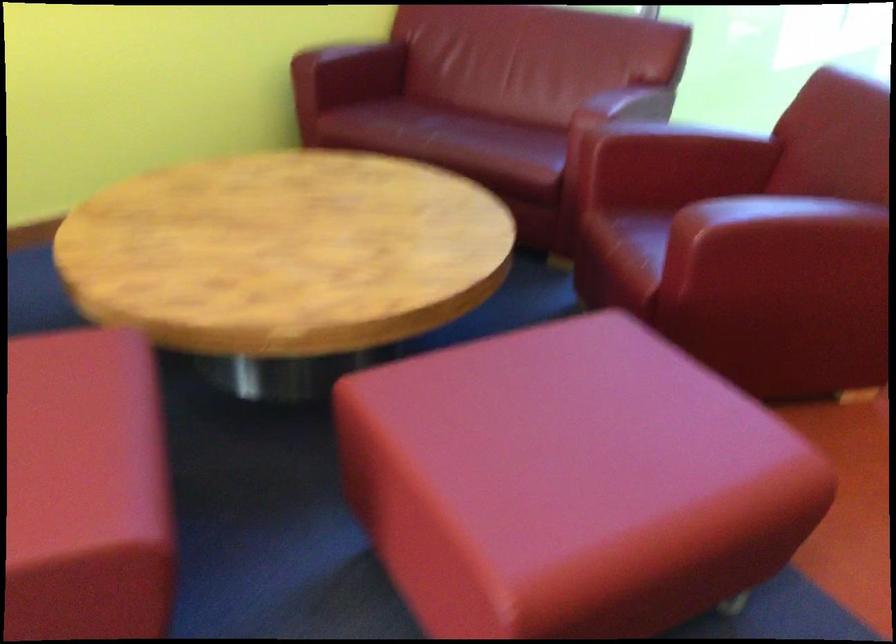
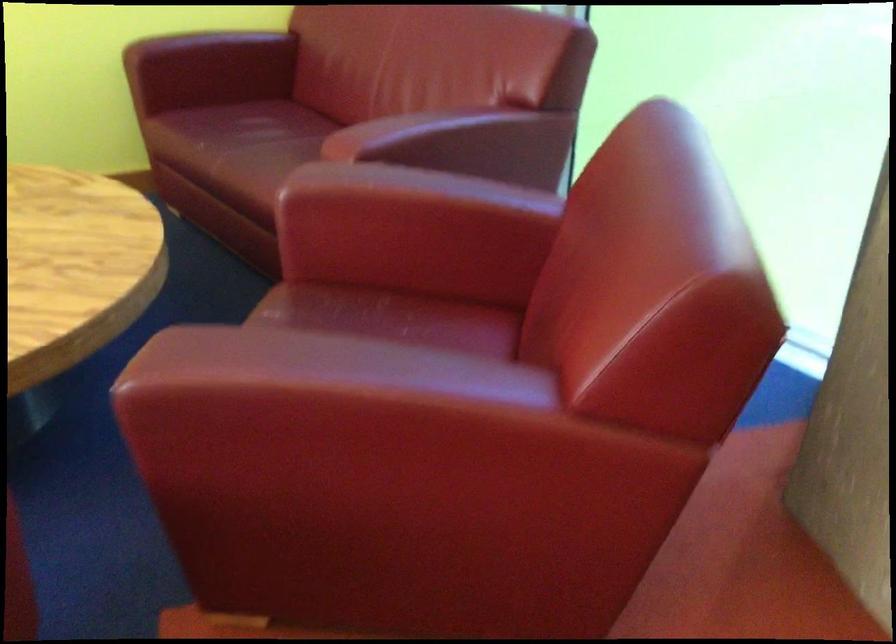
In the second image, find the point that corresponds to point (352, 71) in the first image.

(208, 69)